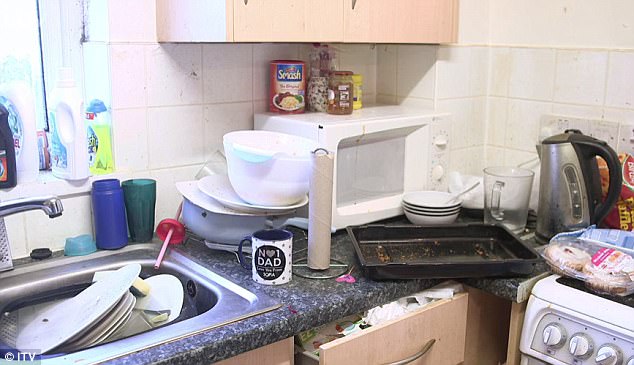
At what (x,y) coordinates should I click in order to perform the action: click on tile backsplash. Please return your answer as a coordinate pair (x, y). Image resolution: width=634 pixels, height=365 pixels. Looking at the image, I should click on (170, 130), (536, 75).